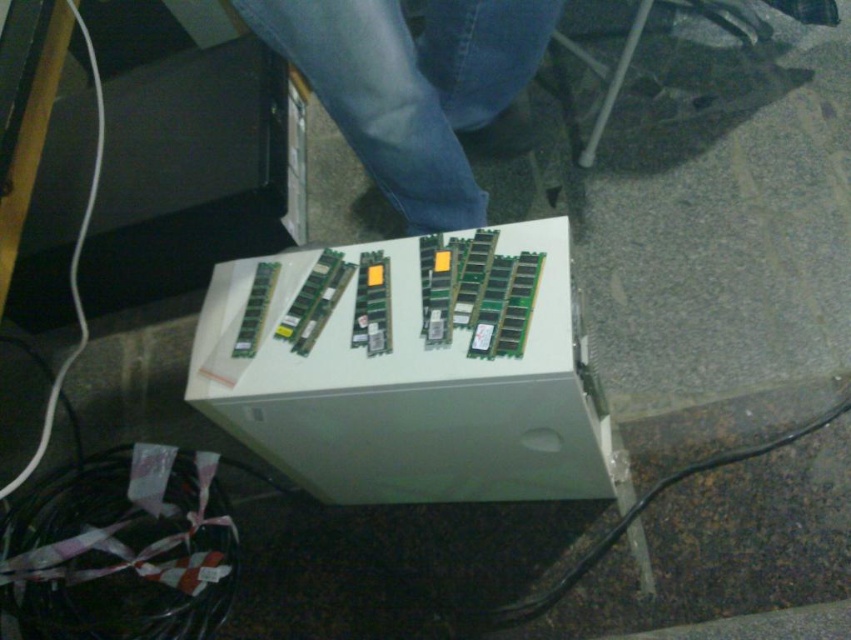
Question: Does jeans at center have a larger size compared to black rubber cable at lower right?

Choices:
 (A) yes
 (B) no

Answer: (A)

Question: Which point is farther to the camera?

Choices:
 (A) (484, 90)
 (B) (466, 416)

Answer: (A)

Question: Is jeans at center wider than black rubber cable at lower right?

Choices:
 (A) yes
 (B) no

Answer: (B)

Question: Estimate the real-world distances between objects in this image. Which object is farther from the jeans at center?

Choices:
 (A) black rubber cable at lower right
 (B) white plastic box at center

Answer: (A)

Question: Does white plastic box at center lie behind jeans at center?

Choices:
 (A) yes
 (B) no

Answer: (B)

Question: Estimate the real-world distances between objects in this image. Which object is closer to the black rubber cable at lower right?

Choices:
 (A) jeans at center
 (B) white plastic box at center

Answer: (B)